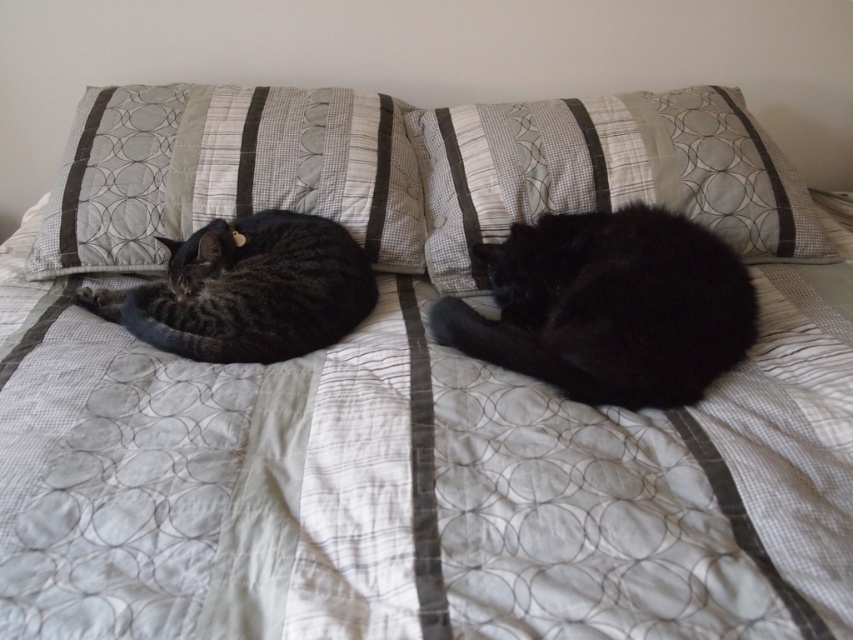
Is textured fabric pillow at center shorter than black silky cat at center?

Incorrect, textured fabric pillow at center's height does not fall short of black silky cat at center's.

Which is in front, point (662, 128) or point (698, 248)?

Point (698, 248) is in front.

In the scene shown: Who is more forward, (793, 188) or (729, 323)?

Point (729, 323) is more forward.

The width and height of the screenshot is (853, 640). I want to click on textured fabric pillow at center, so click(x=606, y=172).

Is textured fabric pillow at upper left to the left of gray striped cat at left from the viewer's perspective?

Indeed, textured fabric pillow at upper left is positioned on the left side of gray striped cat at left.

Is textured fabric pillow at upper left shorter than gray striped cat at left?

No.

Who is more forward, (350, 92) or (338, 250)?

Positioned in front is point (338, 250).

The image size is (853, 640). Find the location of `textured fabric pillow at upper left`. textured fabric pillow at upper left is located at coordinates point(227,172).

Does textured fabric pillow at upper left have a lesser width compared to textured fabric pillow at center?

Correct, textured fabric pillow at upper left's width is less than textured fabric pillow at center's.

Who is more forward, (222, 173) or (434, 212)?

Point (222, 173) is in front.

Locate an element on the screen. textured fabric pillow at upper left is located at coordinates pos(227,172).